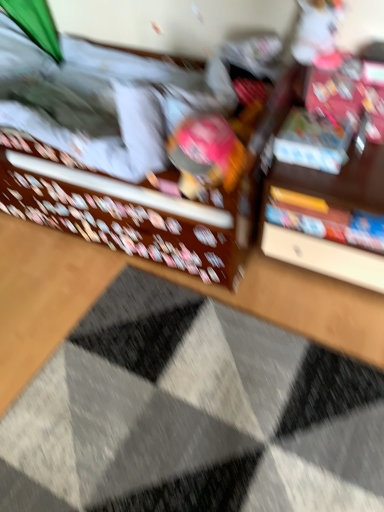
Identify the location of empty space that is ontop of matte plastic book at upper right, placed as the 2th book when sorted from bottom to top (from a real-world perspective). The height and width of the screenshot is (512, 384). (314, 125).